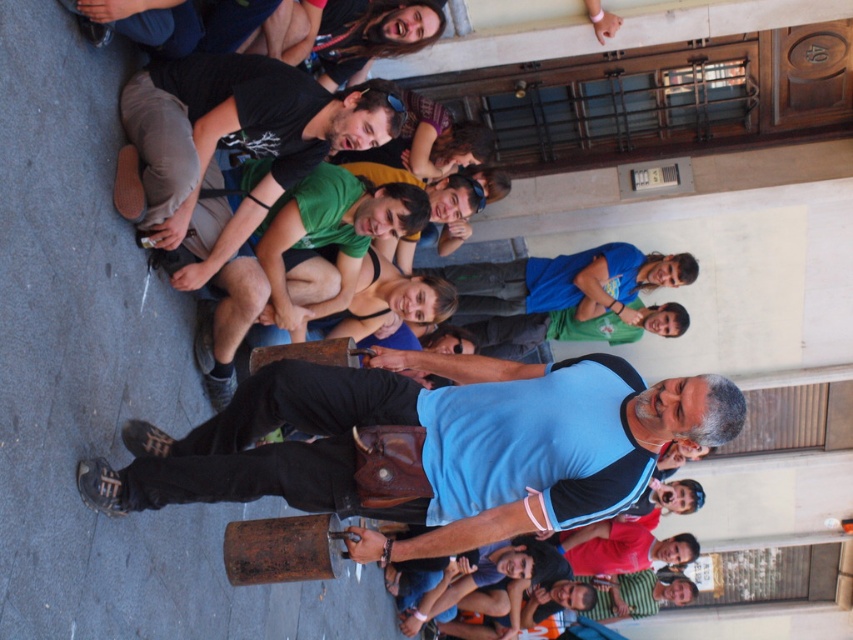
Who is lower down, blue fabric shirt at center or green matte shirt at center?

blue fabric shirt at center is below.

Where is `blue fabric shirt at center`? blue fabric shirt at center is located at coordinates (431, 445).

You are a GUI agent. You are given a task and a screenshot of the screen. Output one action in this format:
    pyautogui.click(x=<x>, y=<y>)
    Task: Click on the blue fabric shirt at center
    
    Given the screenshot: What is the action you would take?
    pyautogui.click(x=431, y=445)